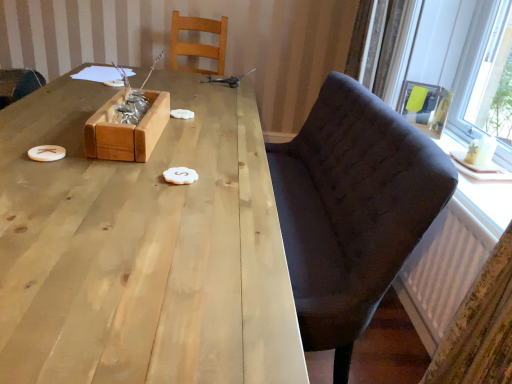
Locate an element on the screen. The image size is (512, 384). vacant area that lies between wooden box at center and white matte cookie at center, the second food in the bottom-to-top sequence is located at coordinates (170, 136).